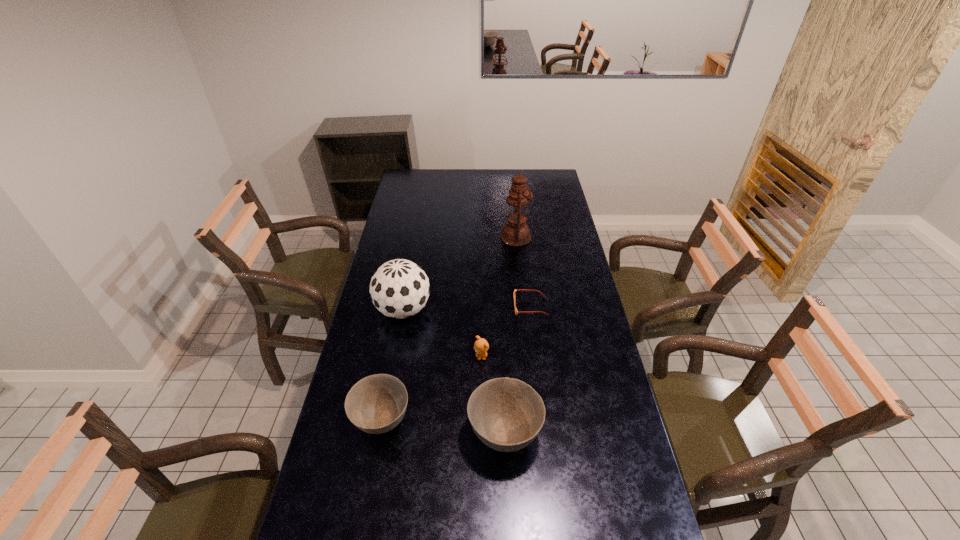
Observe the arrangement of all bowls in the image. To keep them evenly spaced, where would you place another bowl on the right? Please locate a free space. Please provide its 2D coordinates. Your answer should be formatted as a tuple, i.e. [(x, y)], where the tuple contains the x and y coordinates of a point satisfying the conditions above.

[(634, 447)]